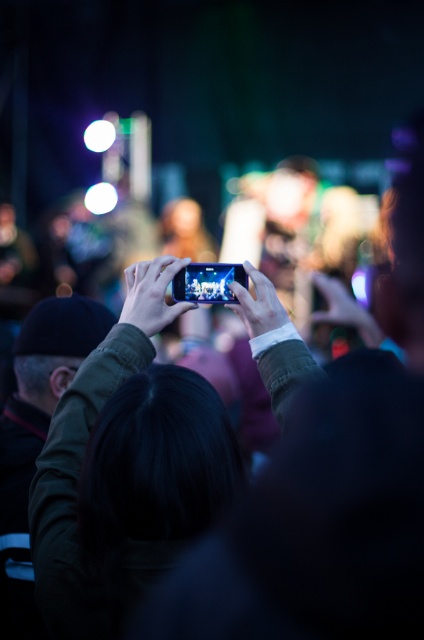
Is shiny black phone at center taller than matte black phone at upper center?

Indeed, shiny black phone at center has a greater height compared to matte black phone at upper center.

Does point (56, 424) come closer to viewer compared to point (233, 268)?

Yes, it is.

Is point (63, 429) less distant than point (222, 285)?

Yes, it is.

Find the location of a particular element. shiny black phone at center is located at coordinates (83, 452).